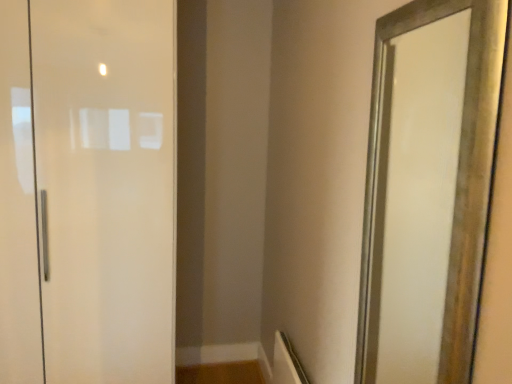
Question: Looking at their shapes, would you say gold-framed mirror at right is wider or thinner than matte white door at left?

Choices:
 (A) wide
 (B) thin

Answer: (B)

Question: Which is correct: gold-framed mirror at right is inside matte white door at left, or outside of it?

Choices:
 (A) outside
 (B) inside

Answer: (A)

Question: From a real-world perspective, is gold-framed mirror at right physically located above or below matte white door at left?

Choices:
 (A) below
 (B) above

Answer: (B)

Question: Is point (162, 162) closer or farther from the camera than point (418, 294)?

Choices:
 (A) farther
 (B) closer

Answer: (B)

Question: In terms of width, does matte white door at left look wider or thinner when compared to gold-framed mirror at right?

Choices:
 (A) thin
 (B) wide

Answer: (B)

Question: Would you say matte white door at left is inside or outside gold-framed mirror at right?

Choices:
 (A) outside
 (B) inside

Answer: (A)

Question: From the image's perspective, is matte white door at left positioned above or below gold-framed mirror at right?

Choices:
 (A) above
 (B) below

Answer: (A)